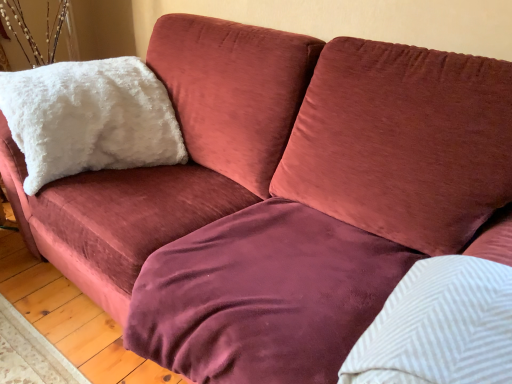
Question: Is white fluffy pillow at upper left, positioned as the second pillow in bottom-to-top order, oriented away from white textured pillow at upper right, which is the second pillow from top to bottom?

Choices:
 (A) no
 (B) yes

Answer: (A)

Question: Is white fluffy pillow at upper left, arranged as the 1th pillow when viewed from the left, wider than white textured pillow at upper right, positioned as the first pillow in right-to-left order?

Choices:
 (A) no
 (B) yes

Answer: (B)

Question: Is white fluffy pillow at upper left, which appears as the 1th pillow when viewed from the back, in front of white textured pillow at upper right, positioned as the first pillow in right-to-left order?

Choices:
 (A) yes
 (B) no

Answer: (B)

Question: From the image's perspective, does white fluffy pillow at upper left, arranged as the 1th pillow when viewed from the left, appear higher than white textured pillow at upper right, the second pillow when ordered from left to right?

Choices:
 (A) yes
 (B) no

Answer: (A)

Question: Could white textured pillow at upper right, positioned as the first pillow in right-to-left order, be considered to be inside white fluffy pillow at upper left, which is counted as the second pillow, starting from the front?

Choices:
 (A) no
 (B) yes

Answer: (A)

Question: Is white textured pillow at upper right, the second pillow when ordered from left to right, in front of or behind white fluffy pillow at upper left, the 2th pillow from the right, in the image?

Choices:
 (A) behind
 (B) front

Answer: (B)

Question: In terms of size, does white textured pillow at upper right, the 1th pillow from the front, appear bigger or smaller than white fluffy pillow at upper left, positioned as the second pillow in bottom-to-top order?

Choices:
 (A) small
 (B) big

Answer: (A)

Question: Does point (381, 336) appear closer or farther from the camera than point (79, 142)?

Choices:
 (A) farther
 (B) closer

Answer: (B)

Question: Looking at their shapes, would you say white textured pillow at upper right, the 1th pillow from the front, is wider or thinner than white fluffy pillow at upper left, the 2th pillow from the right?

Choices:
 (A) thin
 (B) wide

Answer: (A)

Question: Is white fluffy pillow at upper left, arranged as the 1th pillow when viewed from the left, wider or thinner than velvet maroon blanket at center?

Choices:
 (A) thin
 (B) wide

Answer: (A)

Question: Is white fluffy pillow at upper left, which is counted as the second pillow, starting from the front, taller or shorter than velvet maroon blanket at center?

Choices:
 (A) short
 (B) tall

Answer: (B)

Question: Is white fluffy pillow at upper left, which is counted as the second pillow, starting from the front, in front of or behind velvet maroon blanket at center in the image?

Choices:
 (A) front
 (B) behind

Answer: (B)

Question: From a real-world perspective, relative to velvet maroon blanket at center, is white fluffy pillow at upper left, the 2th pillow from the right, vertically above or below?

Choices:
 (A) below
 (B) above

Answer: (B)

Question: Relative to velvet maroon blanket at center, is white textured pillow at upper right, which is the first pillow in bottom-to-top order, in front or behind?

Choices:
 (A) behind
 (B) front

Answer: (B)

Question: Considering the positions of white textured pillow at upper right, positioned as the first pillow in right-to-left order, and velvet maroon blanket at center in the image, is white textured pillow at upper right, positioned as the first pillow in right-to-left order, taller or shorter than velvet maroon blanket at center?

Choices:
 (A) tall
 (B) short

Answer: (B)